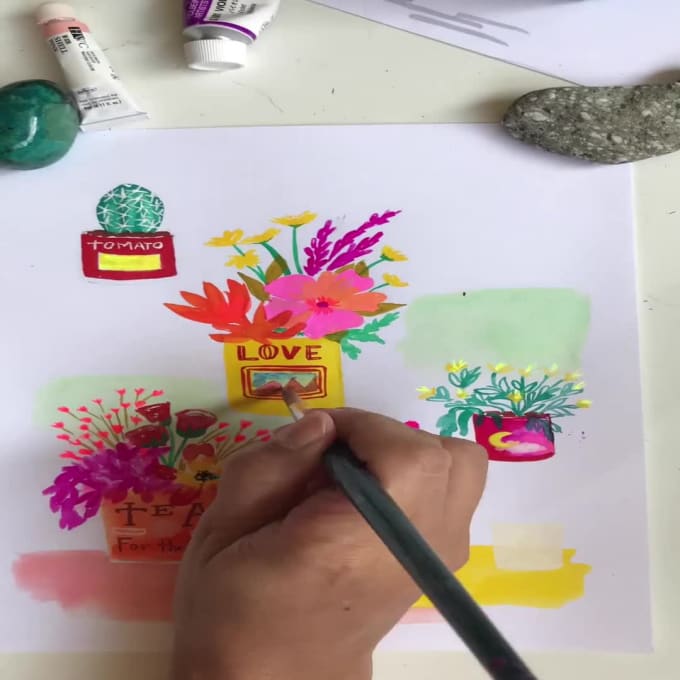
I want to click on pink paint, so click(x=166, y=583).